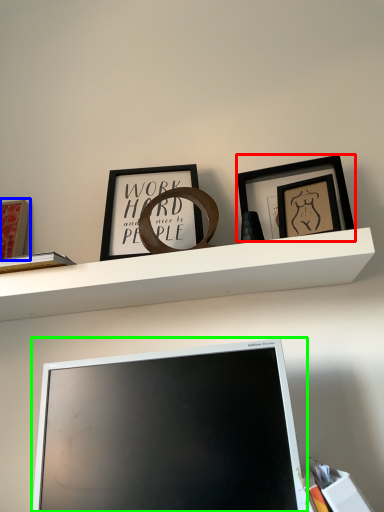
Question: Based on their relative distances, which object is farther from picture frame (highlighted by a red box)? Choose from picture frame (highlighted by a blue box) and computer monitor (highlighted by a green box).

Choices:
 (A) picture frame
 (B) computer monitor

Answer: (A)